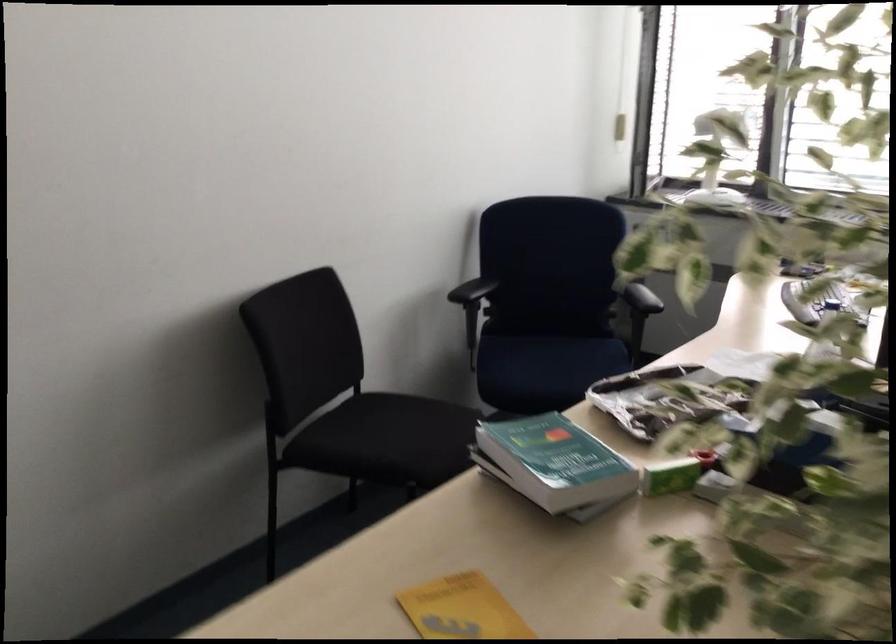
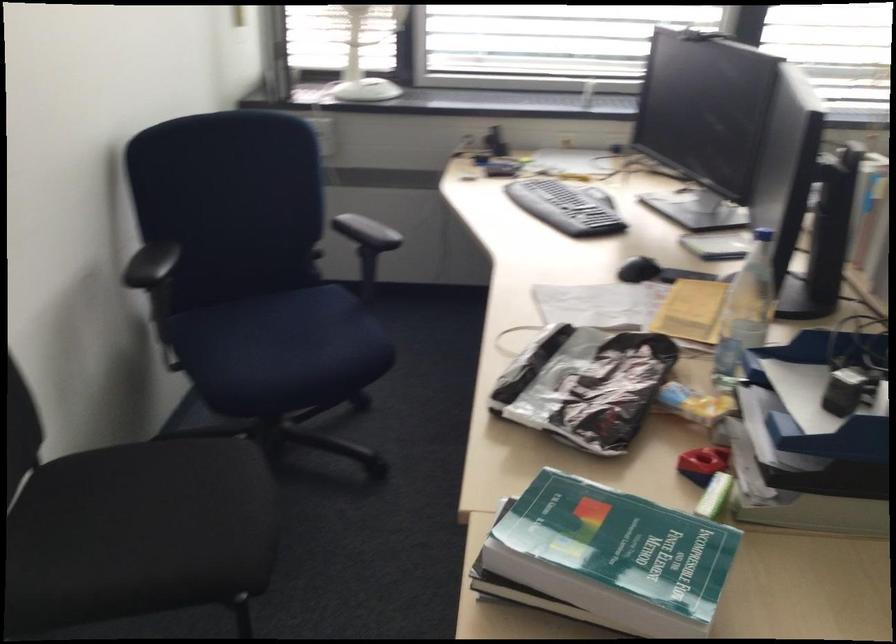
Locate, in the second image, the point that corresponds to (x=540, y=462) in the first image.

(614, 556)